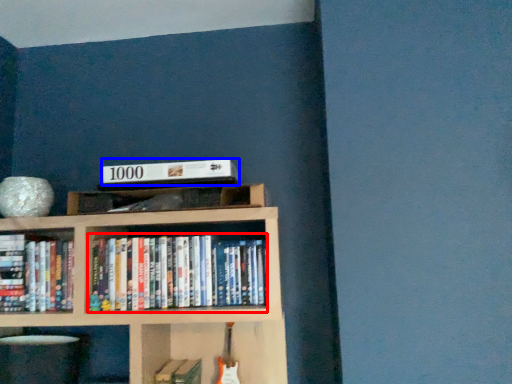
Question: Which object is closer to the camera taking this photo, book (highlighted by a red box) or paperback book (highlighted by a blue box)?

Choices:
 (A) book
 (B) paperback book

Answer: (A)